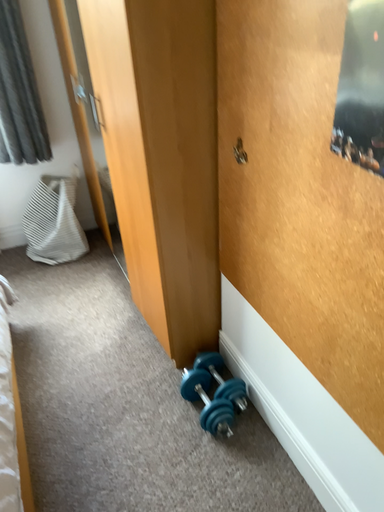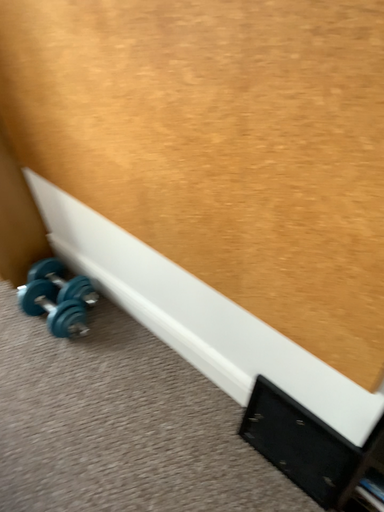
Question: How did the camera likely rotate when shooting the video?

Choices:
 (A) rotated right
 (B) rotated left

Answer: (A)